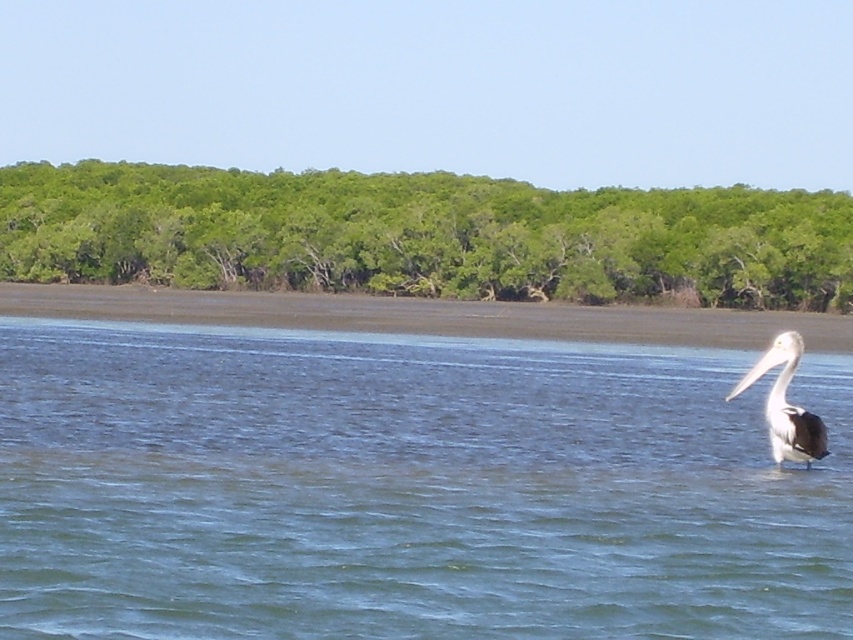
I want to click on blue water at center, so click(407, 486).

Is point (18, 422) positioned behind point (846, 269)?

No, (18, 422) is in front of (846, 269).

This screenshot has width=853, height=640. Find the location of `blue water at center`. blue water at center is located at coordinates (407, 486).

Who is taller, green leafy trees at upper center or white matte pelican at right?

green leafy trees at upper center is taller.

Which is more to the left, green leafy trees at upper center or white matte pelican at right?

Positioned to the left is green leafy trees at upper center.

Find the location of a particular element. green leafy trees at upper center is located at coordinates (422, 236).

I want to click on green leafy trees at upper center, so click(422, 236).

Does blue water at center have a lesser height compared to white matte pelican at right?

In fact, blue water at center may be taller than white matte pelican at right.

Is blue water at center thinner than white matte pelican at right?

In fact, blue water at center might be wider than white matte pelican at right.

Who is more distant from viewer, (329, 422) or (798, 435)?

The point (329, 422) is more distant.

Where is `blue water at center`? Image resolution: width=853 pixels, height=640 pixels. blue water at center is located at coordinates (407, 486).